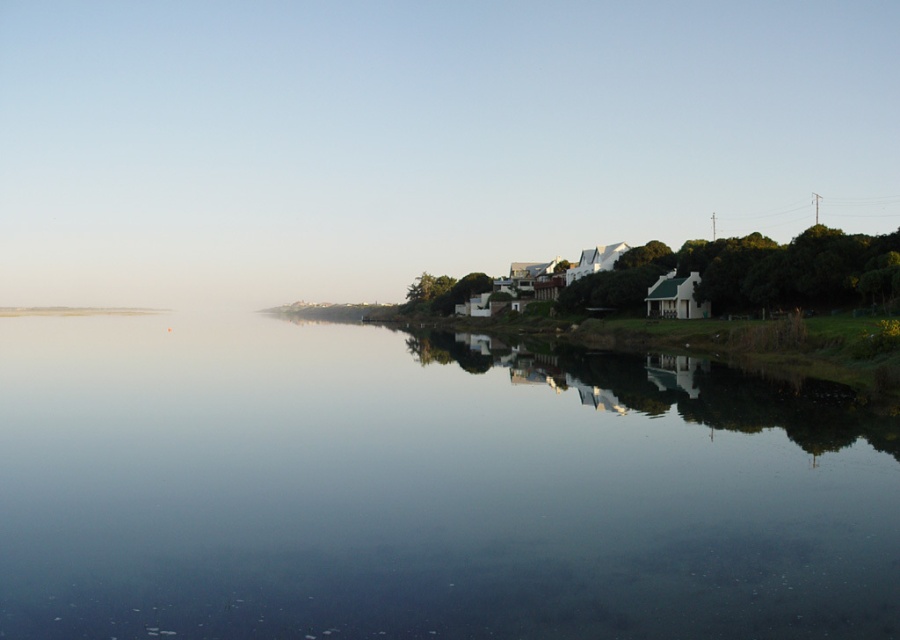
Question: Is transparent water at center behind green leafy tree at right?

Choices:
 (A) yes
 (B) no

Answer: (B)

Question: Is transparent water at center positioned in front of green leafy tree at right?

Choices:
 (A) yes
 (B) no

Answer: (A)

Question: Which point is farther to the camera?

Choices:
 (A) transparent water at center
 (B) green leafy tree at right

Answer: (B)

Question: Can you confirm if transparent water at center is positioned above green leafy tree at right?

Choices:
 (A) yes
 (B) no

Answer: (B)